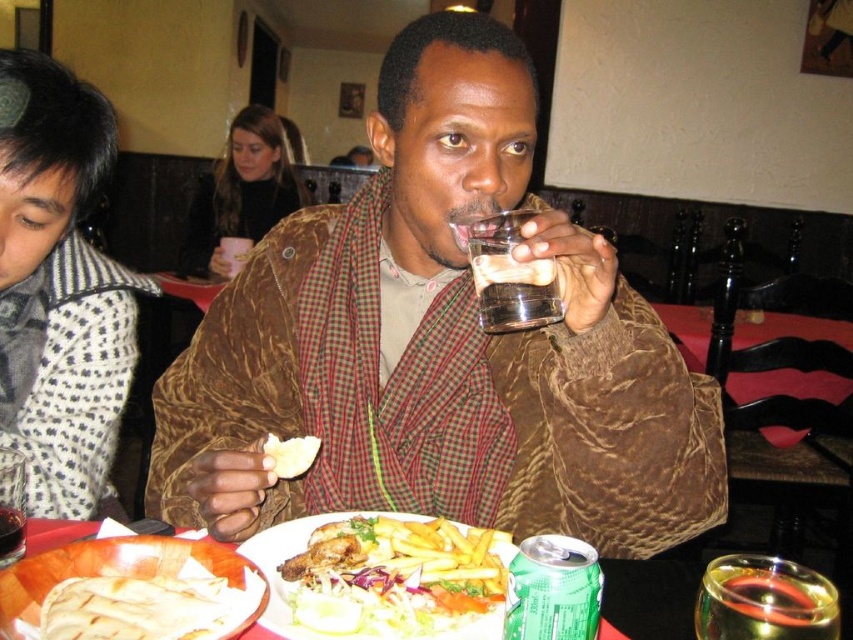
Between golden crispy fries at center and white bread at center, which one is positioned higher?

white bread at center is above.

Who is more distant from viewer, (392, 538) or (292, 470)?

Point (292, 470)

The image size is (853, 640). Describe the element at coordinates (396, 577) in the screenshot. I see `golden crispy fries at center` at that location.

You are a GUI agent. You are given a task and a screenshot of the screen. Output one action in this format:
    pyautogui.click(x=<x>, y=<y>)
    Task: Click on the golden crispy fries at center
    Image resolution: width=853 pixels, height=640 pixels.
    Given the screenshot: What is the action you would take?
    pyautogui.click(x=396, y=577)

Can you confirm if brown textured jacket at center is smaller than white bread at center?

Actually, brown textured jacket at center might be larger than white bread at center.

Which of these two, brown textured jacket at center or white bread at center, stands shorter?

white bread at center is shorter.

Who is more forward, (419, 404) or (271, 445)?

Positioned in front is point (271, 445).

This screenshot has height=640, width=853. Identify the location of brown textured jacket at center. (438, 346).

Is point (660, 557) farther from viewer compared to point (277, 474)?

That is True.

In the scene shown: Is matte plastic plate at center positioned before white bread at center?

Yes, it is in front of white bread at center.

Measure the distance between point (685, 568) and camera.

31.65 inches

In order to click on matte plastic plate at center in this screenshot , I will do click(648, 600).